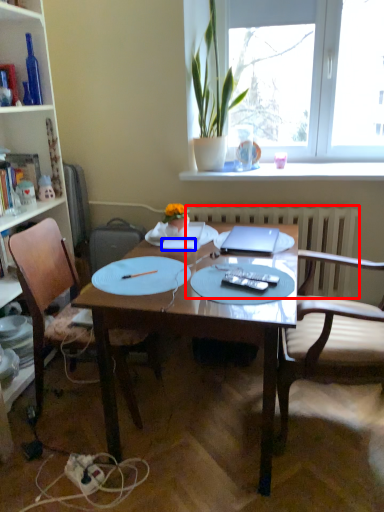
Question: Which object is further to the camera taking this photo, radiator (highlighted by a red box) or notebook (highlighted by a blue box)?

Choices:
 (A) radiator
 (B) notebook

Answer: (A)